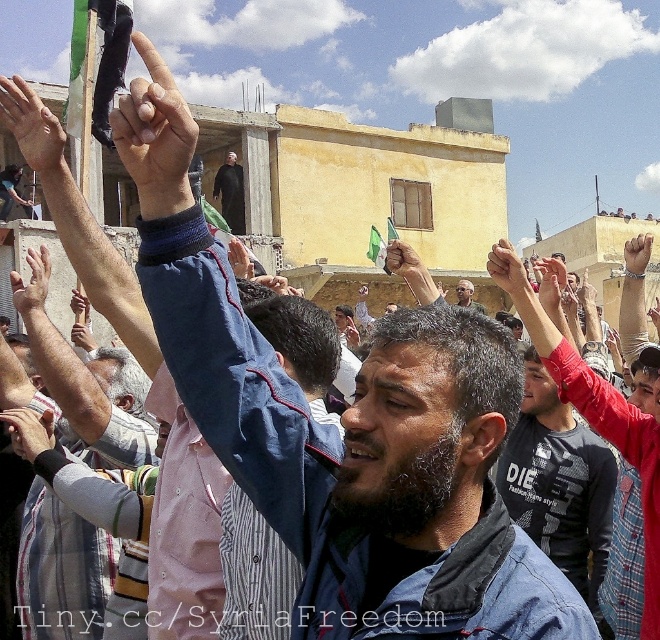
Question: Which point is farther from the camera taking this photo?

Choices:
 (A) (473, 292)
 (B) (26, 458)
 (C) (325, 541)
 (D) (232, 198)

Answer: (A)

Question: Is dark gray t-shirt at center above matte black hand at upper right?

Choices:
 (A) no
 (B) yes

Answer: (A)

Question: Among these objects, which one is nearest to the camera?

Choices:
 (A) matte black hand at upper center
 (B) gray beard at center
 (C) dark blue fabric at center

Answer: (A)

Question: Is dark gray t-shirt at center smaller than smooth skin hand at center?

Choices:
 (A) yes
 (B) no

Answer: (A)

Question: Which is farther from the dark blue fabric at center?

Choices:
 (A) matte black hand at upper center
 (B) dark gray t-shirt at center

Answer: (B)

Question: Does blue denim jacket at center appear over smooth skin hand at center?

Choices:
 (A) no
 (B) yes

Answer: (A)